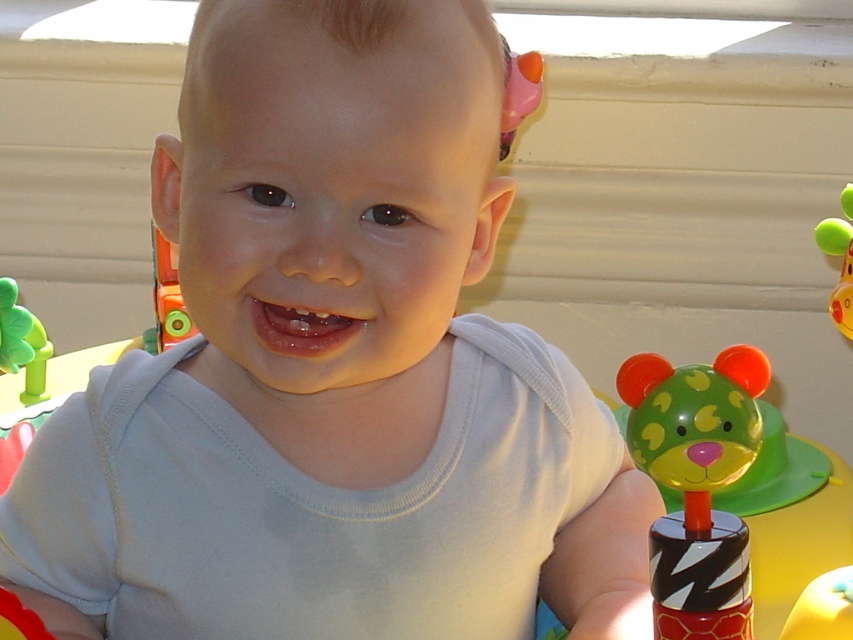
Question: Is green rubber toy at left below green rubber duck at right?

Choices:
 (A) yes
 (B) no

Answer: (A)

Question: Is green matte bear at right smaller than green rubber duck at right?

Choices:
 (A) no
 (B) yes

Answer: (A)

Question: Which point appears farthest from the camera in this image?

Choices:
 (A) (22, 337)
 (B) (830, 250)

Answer: (A)

Question: Does green matte bear at right appear on the left side of green rubber duck at right?

Choices:
 (A) no
 (B) yes

Answer: (B)

Question: Estimate the real-world distances between objects in this image. Which object is farther from the green rubber duck at right?

Choices:
 (A) green matte bear at right
 (B) green rubber toy at left

Answer: (B)

Question: Which object is positioned closest to the green rubber duck at right?

Choices:
 (A) green rubber toy at left
 (B) green matte bear at right

Answer: (B)